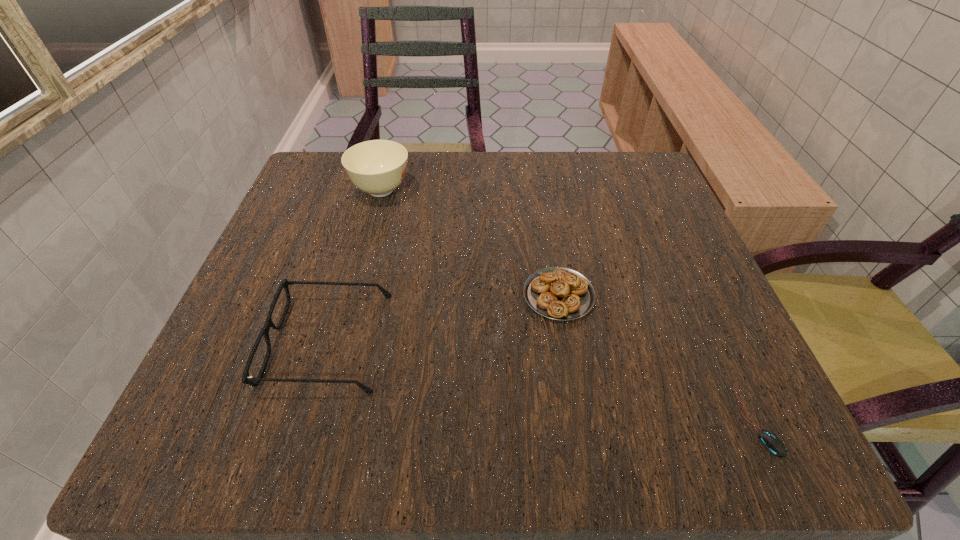
Identify the location of unoccupied area between the sugar bowl and the second object from right to left. (469, 242).

Identify the location of free space between the nearest object and the pastry. pyautogui.click(x=660, y=361).

Identify the location of vacant space that's between the shortest object and the spectacles. This screenshot has width=960, height=540. (544, 384).

You are a GUI agent. You are given a task and a screenshot of the screen. Output one action in this format:
    pyautogui.click(x=<x>, y=<y>)
    Task: Click on the free space between the second tallest object and the rightmost object
    
    Given the screenshot: What is the action you would take?
    pyautogui.click(x=544, y=384)

Choose which object is the third nearest neighbor to the rightmost object. Please provide its 2D coordinates. Your answer should be formatted as a tuple, i.e. [(x, y)], where the tuple contains the x and y coordinates of a point satisfying the conditions above.

[(377, 167)]

Locate which object is the second closest to the sugar bowl. Please provide its 2D coordinates. Your answer should be formatted as a tuple, i.e. [(x, y)], where the tuple contains the x and y coordinates of a point satisfying the conditions above.

[(558, 293)]

At what (x,y) coordinates should I click in order to perform the action: click on free space that satisfies the following two spatial constraints: 1. on the front side of the third tallest object; 2. on the left side of the sugar bowl. Please return your answer as a coordinate pair (x, y). The height and width of the screenshot is (540, 960). Looking at the image, I should click on (353, 295).

This screenshot has height=540, width=960. Find the location of `free space that satisfies the following two spatial constraints: 1. on the front-facing side of the third shortest object; 2. on the back side of the sugar bowl`. free space that satisfies the following two spatial constraints: 1. on the front-facing side of the third shortest object; 2. on the back side of the sugar bowl is located at coordinates (372, 190).

At what (x,y) coordinates should I click in order to perform the action: click on vacant region that satisfies the following two spatial constraints: 1. on the front side of the sugar bowl; 2. on the right side of the third object from left to right. Please return your answer as a coordinate pair (x, y). The width and height of the screenshot is (960, 540). Looking at the image, I should click on (353, 295).

The image size is (960, 540). Identify the location of vacant region that satisfies the following two spatial constraints: 1. on the front side of the nearest object; 2. on the right side of the second shortest object. (581, 427).